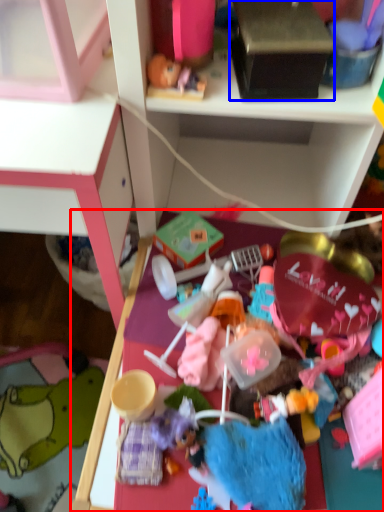
Question: Which point is closer to the camera, table (highlighted by a red box) or box (highlighted by a blue box)?

Choices:
 (A) table
 (B) box

Answer: (A)